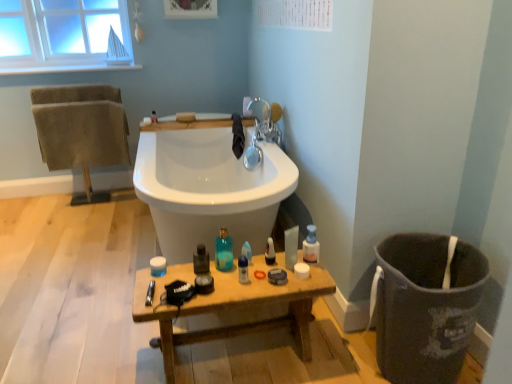
Image resolution: width=512 pixels, height=384 pixels. Find the location of `free space that is in between blue glossy bottle at center, which is the 1th mouthwash in right-to-left order, and translucent plastic spray bottle at center, arranged as the 2th cleaning product when viewed from the left`. free space that is in between blue glossy bottle at center, which is the 1th mouthwash in right-to-left order, and translucent plastic spray bottle at center, arranged as the 2th cleaning product when viewed from the left is located at coordinates (258, 267).